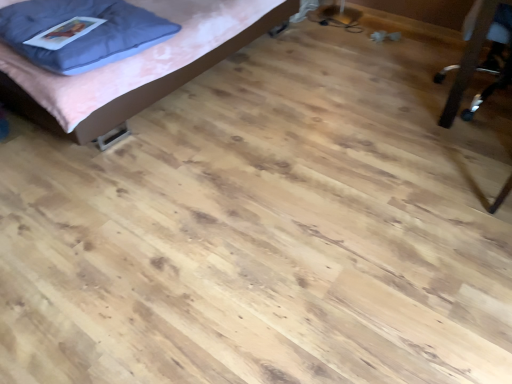
Question: Based on their positions, is blue fabric pillow at upper left located to the left or right of matte pink bed at upper left?

Choices:
 (A) right
 (B) left

Answer: (B)

Question: From their relative heights in the image, would you say blue fabric pillow at upper left is taller or shorter than matte pink bed at upper left?

Choices:
 (A) short
 (B) tall

Answer: (A)

Question: Which is nearer to the blue fabric pillow at upper left?

Choices:
 (A) matte pink bed at upper left
 (B) metallic silver chair at right

Answer: (A)

Question: Based on their relative distances, which object is nearer to the matte pink bed at upper left?

Choices:
 (A) metallic silver chair at right
 (B) blue fabric pillow at upper left

Answer: (B)